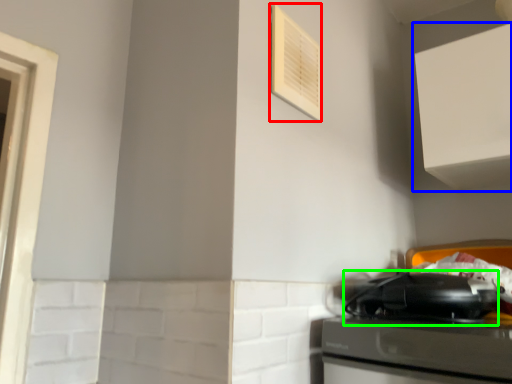
Question: Based on their relative distances, which object is farther from air conditioner (highlighted by a red box)? Choose from cabinetry (highlighted by a blue box) and appliance (highlighted by a green box).

Choices:
 (A) cabinetry
 (B) appliance

Answer: (B)